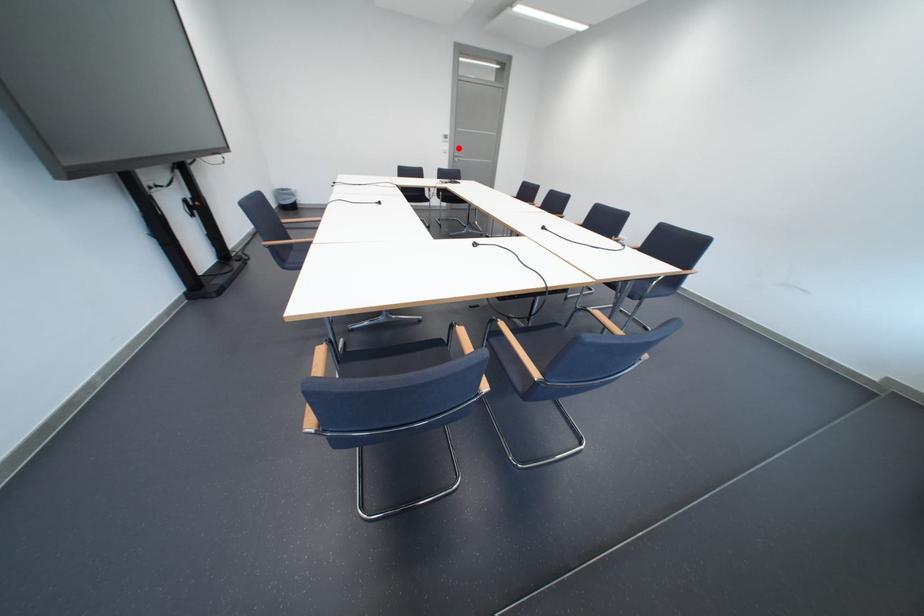
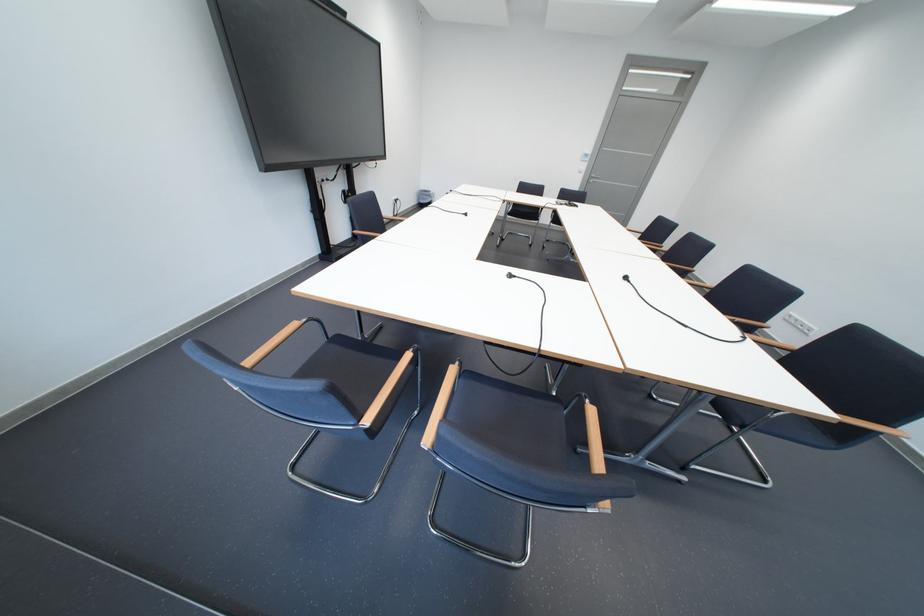
Question: A red point is marked in image1. In image2, is the corresponding 3D point closer to the camera or farther? Reply with the corresponding letter.

Choices:
 (A) The corresponding 3D point is closer.
 (B) The corresponding 3D point is farther.

Answer: (B)